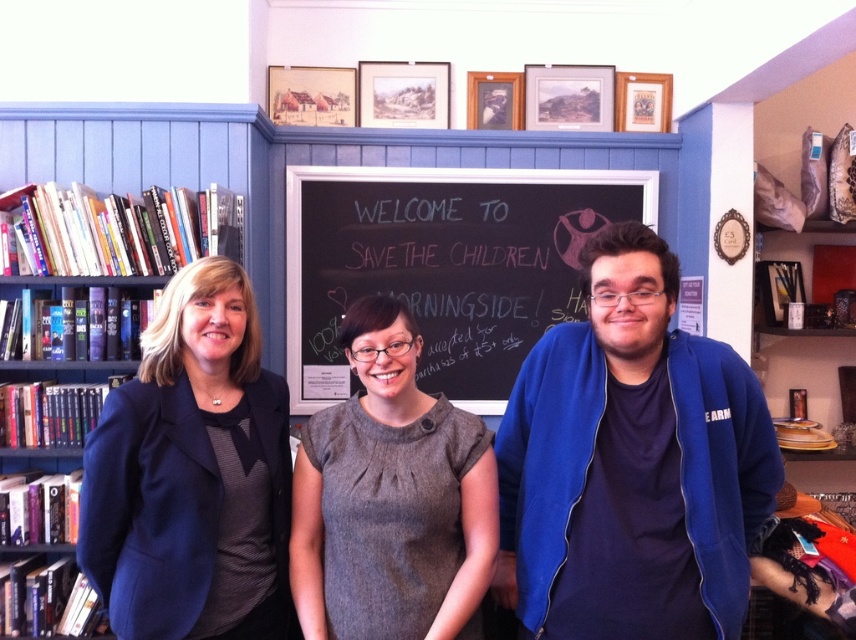
You are a guest entering the community center and see the navy blue fabric jacket at left and the black chalkboard at center. Which object is positioned lower in the image?

The navy blue fabric jacket at left is located below the black chalkboard at center, so it is positioned lower in the image.

You are organizing a charity event and need to display two jackets as part of a donation drive. The jackets are the blue fleece jacket at center and the navy blue fabric jacket at left. Which jacket should you choose if you want to display a larger one?

The blue fleece jacket at center is larger in size than the navy blue fabric jacket at left, so you should choose the blue fleece jacket at center for the display.

You are standing in the community center and need to locate the blue fleece jacket at center. According to the coordinates provided, where would you find it?

The blue fleece jacket at center is located at coordinates point (631, 464).